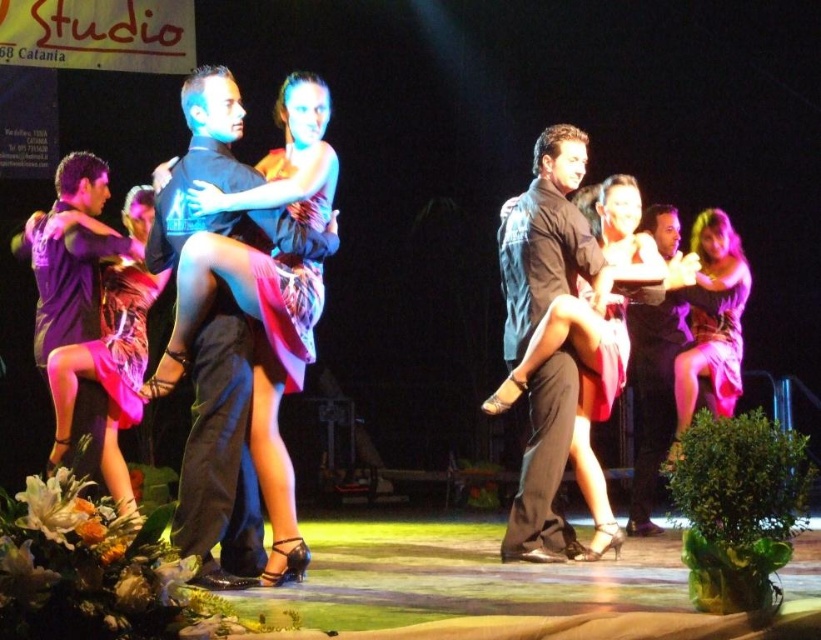
Can you confirm if black smooth shirt at center is smaller than pink satin dress at right?

Yes.

Is black smooth shirt at center bigger than pink satin dress at right?

No.

The height and width of the screenshot is (640, 821). I want to click on black smooth shirt at center, so (x=544, y=237).

Between point (526, 248) and point (132, 298), which one is positioned in front?

Point (526, 248) is in front.

Is point (502, 260) in front of point (70, 392)?

No, (502, 260) is behind (70, 392).

Is point (516, 280) behind point (136, 301)?

No.

Where is `black smooth shirt at center`? The height and width of the screenshot is (640, 821). black smooth shirt at center is located at coordinates (544, 237).

Looking at this image, can you confirm if black satin suit at center is positioned above pink satin dress at left?

Correct, black satin suit at center is located above pink satin dress at left.

Locate an element on the screen. This screenshot has height=640, width=821. black satin suit at center is located at coordinates (216, 323).

Is point (296, 225) farther from viewer compared to point (132, 260)?

No.

This screenshot has height=640, width=821. I want to click on black satin suit at center, so click(216, 323).